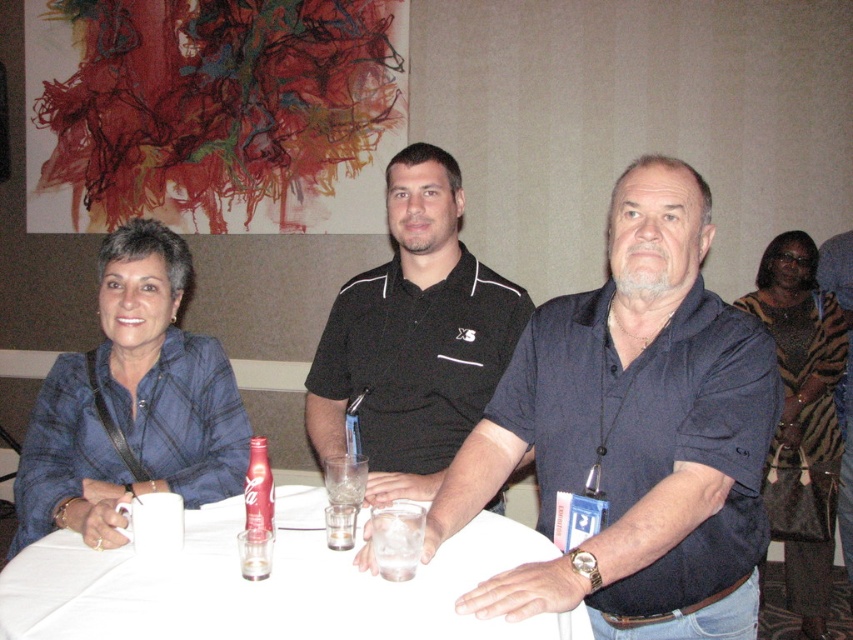
Question: Which of the following is the closest to the observer?

Choices:
 (A) (418, 518)
 (B) (469, 460)
 (C) (234, 384)

Answer: (A)

Question: Is blue plaid shirt at left to the right of black matte polo shirt at center from the viewer's perspective?

Choices:
 (A) no
 (B) yes

Answer: (A)

Question: Which point is closer to the camera?

Choices:
 (A) (386, 516)
 (B) (138, 636)
 (C) (76, 461)
 (D) (814, 580)

Answer: (B)

Question: Is white plastic table at center thinner than clear glass ice at table center?

Choices:
 (A) yes
 (B) no

Answer: (B)

Question: Can you confirm if dark blue shirt at center is thinner than black matte polo shirt at center?

Choices:
 (A) no
 (B) yes

Answer: (A)

Question: Which object appears farthest from the camera in this image?

Choices:
 (A) white plastic table at center
 (B) black matte polo shirt at center

Answer: (B)